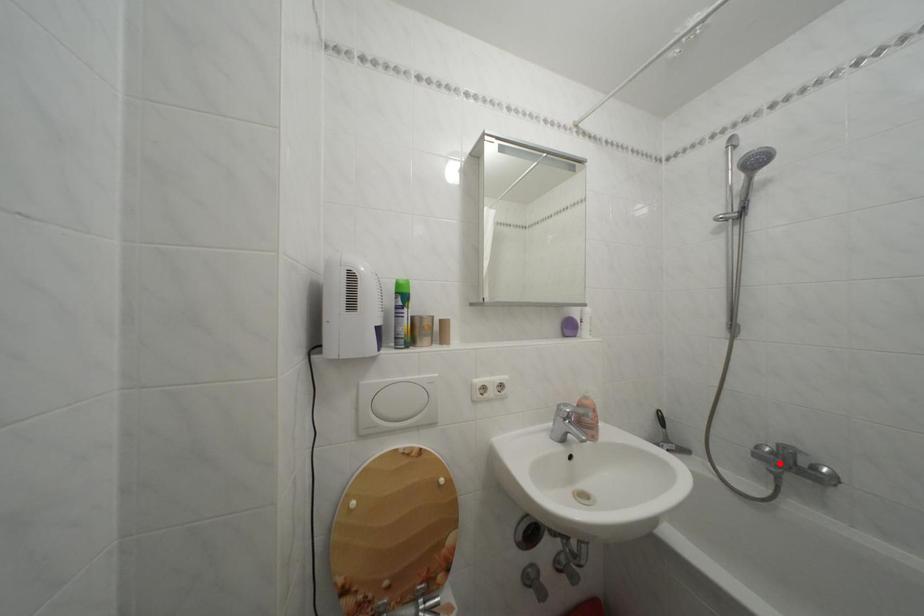
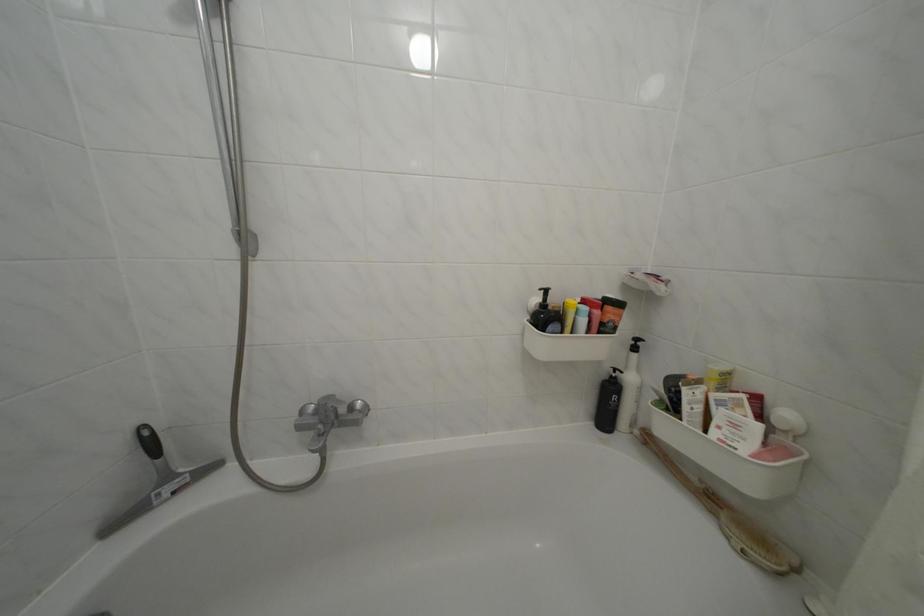
Where in the second image is the point corresponding to the highlighted location from the first image?

(323, 426)